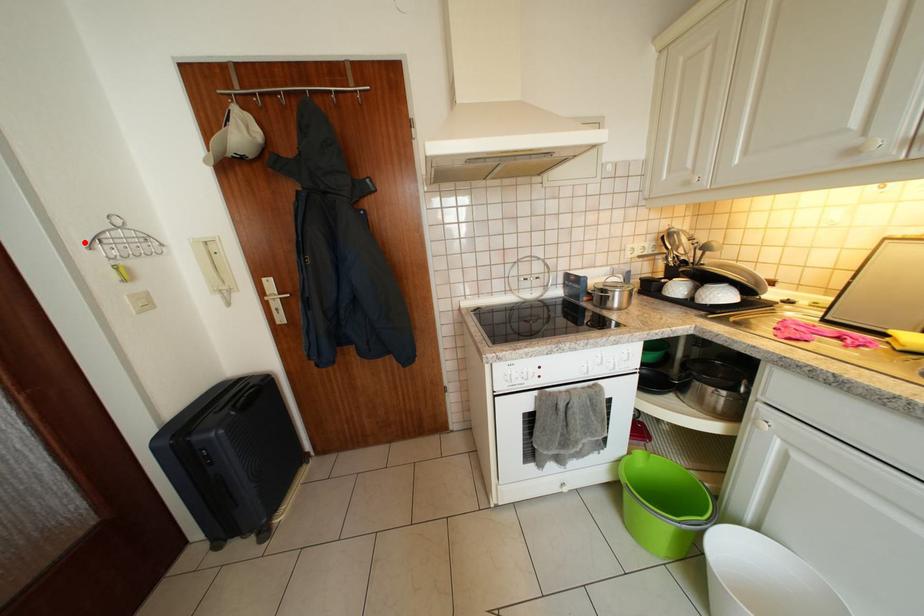
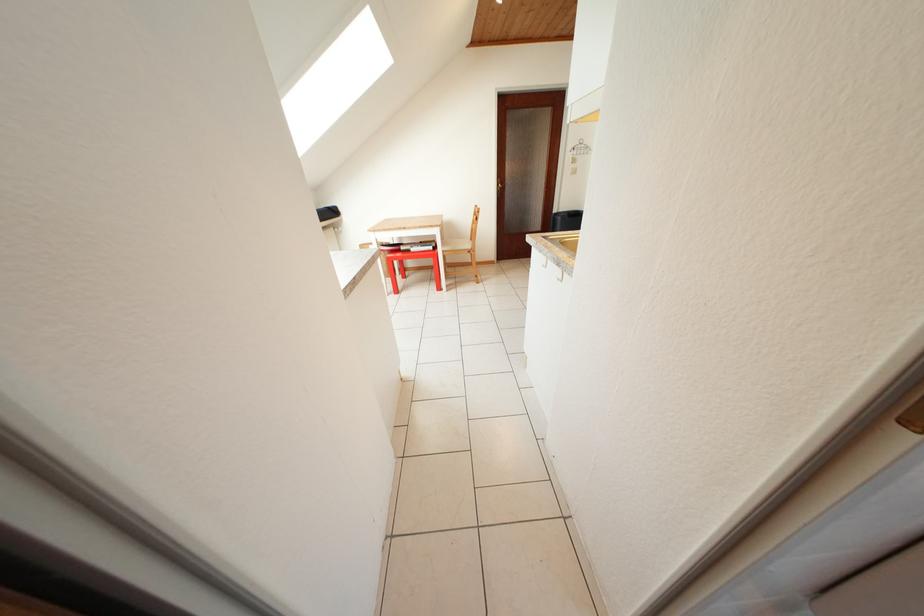
Find the pixel in the second image that matches the highlighted location in the first image.

(578, 153)